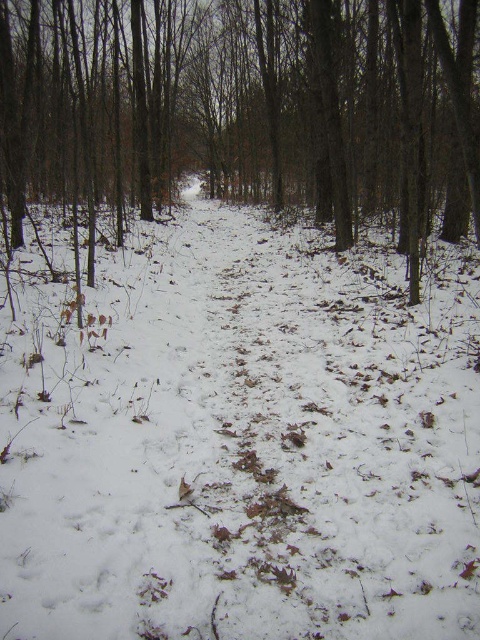
Question: Which object is farther from the camera taking this photo?

Choices:
 (A) brown matte tree at center
 (B) white powdery snow at center

Answer: (A)

Question: Does white powdery snow at center have a larger size compared to brown matte tree at center?

Choices:
 (A) yes
 (B) no

Answer: (B)

Question: Which point is closer to the camera?

Choices:
 (A) brown matte tree at center
 (B) white powdery snow at center

Answer: (B)

Question: Does white powdery snow at center have a smaller size compared to brown matte tree at center?

Choices:
 (A) no
 (B) yes

Answer: (B)

Question: Does white powdery snow at center have a greater width compared to brown matte tree at center?

Choices:
 (A) yes
 (B) no

Answer: (B)